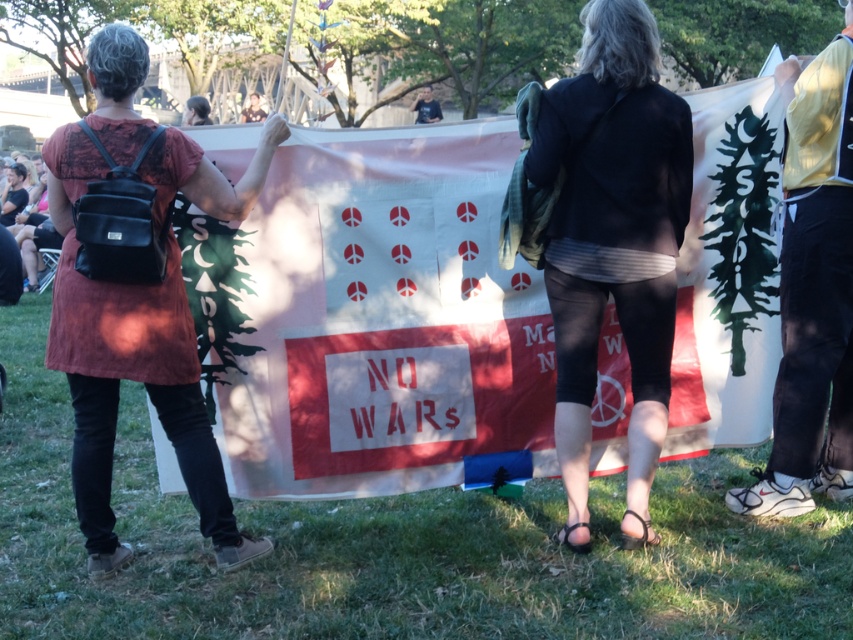
You are a photographer trying to capture the protest scene. You notice two points in the image at coordinates point [624,38] and point [184,342]. Which point is more likely to be in focus if your camera is focused on the banner?

Point [624,38] is closer to the camera than point [184,342], so it will be in focus if the camera is focused on the banner.

You are a photographer trying to capture a photo of the protest banner. You notice two items in the foreground that might obstruct your shot. Which item is closer to the banner between the black fabric jacket at center and the matte black backpack at left?

The black fabric jacket at center is positioned on the right side of the matte black backpack at left, meaning the jacket is closer to the banner than the backpack.

You are a photographer at the protest scene. You need to capture a photo of the black fabric jacket at center and the matte black backpack at left. Which object should you zoom in on to ensure both are clearly visible in the frame?

The black fabric jacket at center is smaller in size compared to the matte black backpack at left, so you should zoom in on the matte black backpack at left to ensure both are clearly visible in the frame.